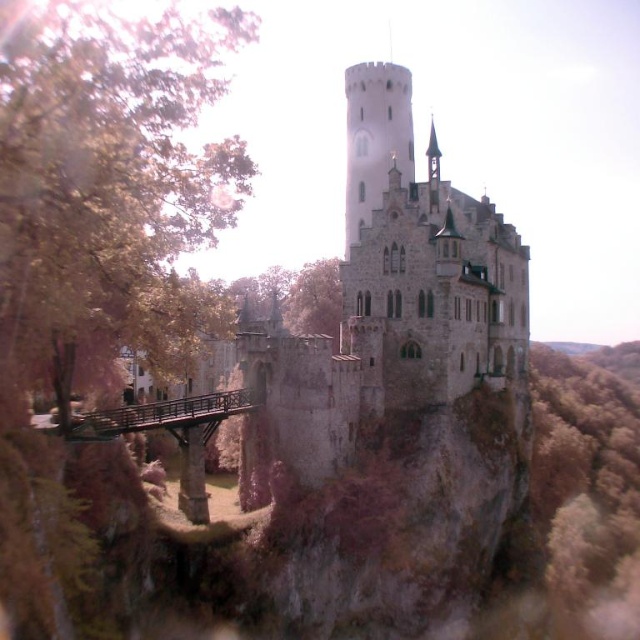
You are an archer positioned on the stone medieval castle at center. You need to shoot an arrow to the brown wooden bridge at lower center. What is the approximate distance you need to aim for?

The stone medieval castle at center is 97.72 feet away from the brown wooden bridge at lower center, so you should aim for approximately 98 feet.

In the scene shown: You are a visitor approaching the stone medieval castle at center from a distance. As you walk towards it, you notice the brown wooden bridge at lower center in your path. Which structure will appear larger to you as you get closer?

The stone medieval castle at center will appear larger as you get closer because it is much taller than the brown wooden bridge at lower center.